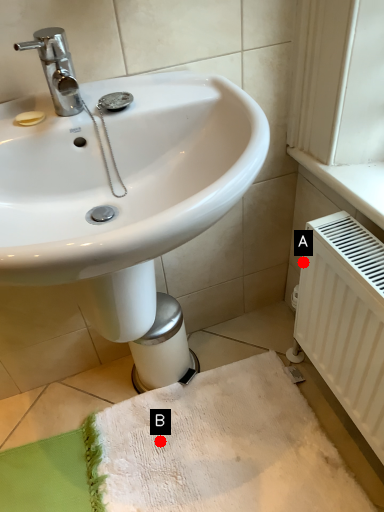
Question: Two points are circled on the image, labeled by A and B beside each circle. Which point is closer to the camera taking this photo?

Choices:
 (A) A is closer
 (B) B is closer

Answer: (A)